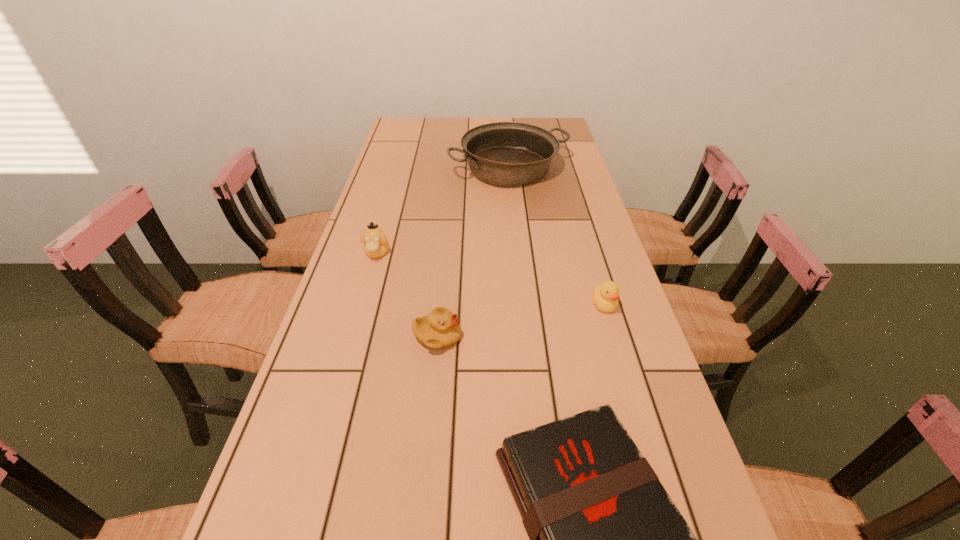
Select which object appears as the third closest to the rightmost duckling. Please provide its 2D coordinates. Your answer should be formatted as a tuple, i.e. [(x, y)], where the tuple contains the x and y coordinates of a point satisfying the conditions above.

[(502, 153)]

Identify the location of duckling that is the second closest to the nearest duckling. (605, 296).

The height and width of the screenshot is (540, 960). In order to click on duckling that can be found as the second closest to the second farthest object in this screenshot , I will do `click(605, 296)`.

The image size is (960, 540). I want to click on free point that satisfies the following two spatial constraints: 1. on the face of the rightmost duckling; 2. on the front-facing side of the nearest duckling, so click(x=614, y=337).